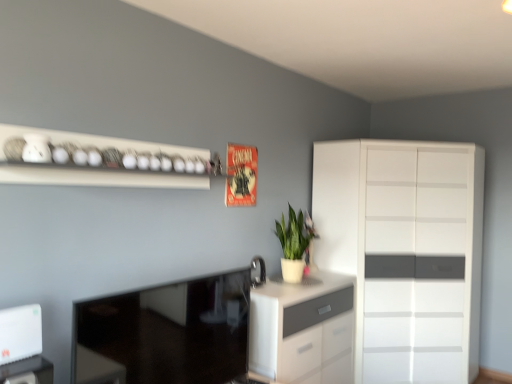
Question: In terms of width, does white plastic router at lower left, which is the 1th appliance in left-to-right order, look wider or thinner when compared to white glossy cupboard at right?

Choices:
 (A) thin
 (B) wide

Answer: (A)

Question: From the image's perspective, is white plastic router at lower left, the 2th appliance in the back-to-front sequence, above or below white glossy cupboard at right?

Choices:
 (A) above
 (B) below

Answer: (A)

Question: Which is nearer to the glossy black tv at lower left?

Choices:
 (A) white glossy cupboard at right
 (B) satin nickel faucet at center, marked as the 1th appliance in a back-to-front arrangement
 (C) white plastic router at lower left, positioned as the first appliance in front-to-back order
 (D) green matte plant at center
 (E) white glossy shelf at upper left

Answer: (C)

Question: Estimate the real-world distances between objects in this image. Which object is farther from the white plastic router at lower left, positioned as the 2th appliance in right-to-left order?

Choices:
 (A) green matte plant at center
 (B) white glossy cupboard at right
 (C) glossy black tv at lower left
 (D) white glossy shelf at upper left
 (E) satin nickel faucet at center, marked as the first appliance in a right-to-left arrangement

Answer: (B)